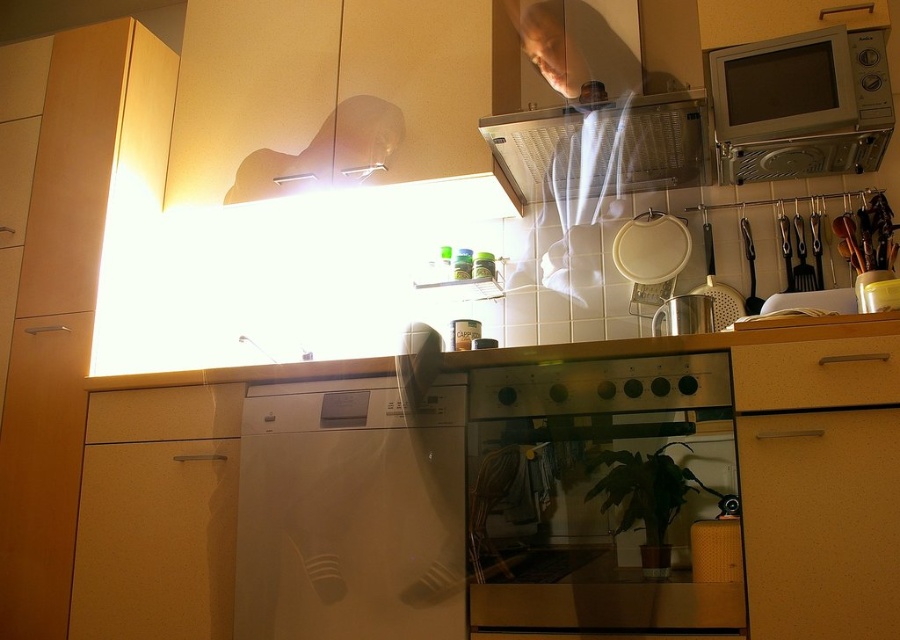
Can you confirm if white fabric at upper center is shorter than matte wood drawer at lower left?

Incorrect, white fabric at upper center's height does not fall short of matte wood drawer at lower left's.

Between point (621, 36) and point (185, 392), which one is positioned in front?

Point (185, 392) is in front.

Who is more distant from viewer, (567, 218) or (244, 388)?

Point (567, 218)

Locate an element on the screen. The width and height of the screenshot is (900, 640). white fabric at upper center is located at coordinates (576, 49).

Locate an element on the screen. This screenshot has width=900, height=640. metallic grid exhaust hood at upper center is located at coordinates (603, 147).

The width and height of the screenshot is (900, 640). Describe the element at coordinates (603, 147) in the screenshot. I see `metallic grid exhaust hood at upper center` at that location.

Locate an element on the screen. metallic grid exhaust hood at upper center is located at coordinates (603, 147).

Who is taller, white glossy dishwasher at center or matte wood drawer at lower left?

white glossy dishwasher at center

Looking at this image, does white glossy dishwasher at center come in front of matte wood drawer at lower left?

Yes, white glossy dishwasher at center is closer to the viewer.

Which is behind, point (340, 602) or point (133, 438)?

The point (133, 438) is more distant.

Locate an element on the screen. This screenshot has width=900, height=640. white glossy dishwasher at center is located at coordinates (349, 513).